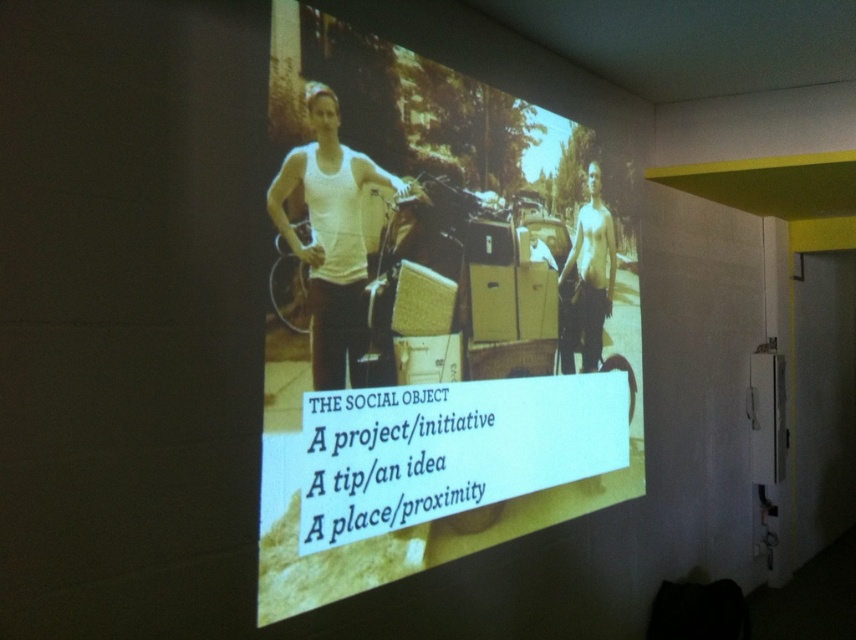
You are an event organizer who needs to place a 5.5 feet long banner between the two groups of yellowish cardboard boxes at center. Will the banner fit between them?

The yellowish cardboard boxes at center are 6.53 feet apart, so a 5.5 feet long banner will fit between them since the distance between the boxes is greater than the banner length.

You are an event planner setting up for a presentation. You need to ensure that the two main figures on the projected slide are visible to the audience. Given the description, which of the two figures, the white matte tank top at center or the shiny metallic man at center, will appear smaller on the slide?

The white matte tank top at center is shorter than the shiny metallic man at center, so the white matte tank top at center will appear smaller on the slide.